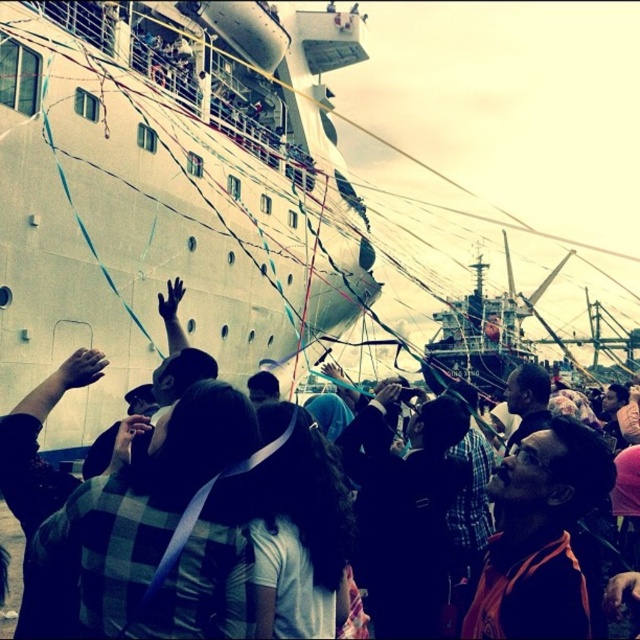
Question: Is white matte ship at upper left smaller than black fabric crowd at lower center?

Choices:
 (A) no
 (B) yes

Answer: (B)

Question: Can you confirm if white matte ship at upper left is positioned to the right of black fabric crowd at lower center?

Choices:
 (A) no
 (B) yes

Answer: (A)

Question: Which of the following is the farthest from the observer?

Choices:
 (A) (624, 451)
 (B) (230, 77)

Answer: (B)

Question: Which point is closer to the camera taking this photo?

Choices:
 (A) coord(624,488)
 (B) coord(70,404)

Answer: (B)

Question: Which point is closer to the camera?

Choices:
 (A) (285, 196)
 (B) (541, 387)

Answer: (B)

Question: Can you confirm if white matte ship at upper left is wider than black fabric crowd at lower center?

Choices:
 (A) yes
 (B) no

Answer: (B)